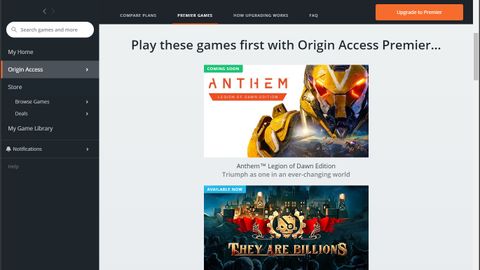
The image size is (480, 270). In order to click on white rectangle with rounded corners -- "search" box in this screenshot , I will do `click(59, 31)`.